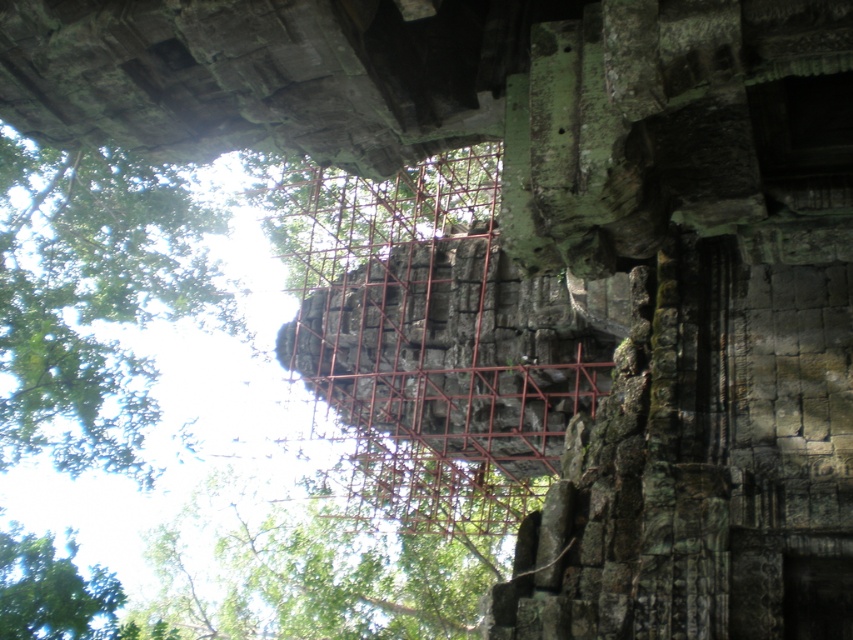
I want to click on green leafy tree at upper left, so click(x=91, y=296).

Is green leafy tree at upper left behind green stone structure at center?

Yes.

Does point (4, 208) come in front of point (492, 154)?

No, it is behind (492, 154).

Image resolution: width=853 pixels, height=640 pixels. What are the coordinates of `green leafy tree at upper left` in the screenshot? It's located at (91, 296).